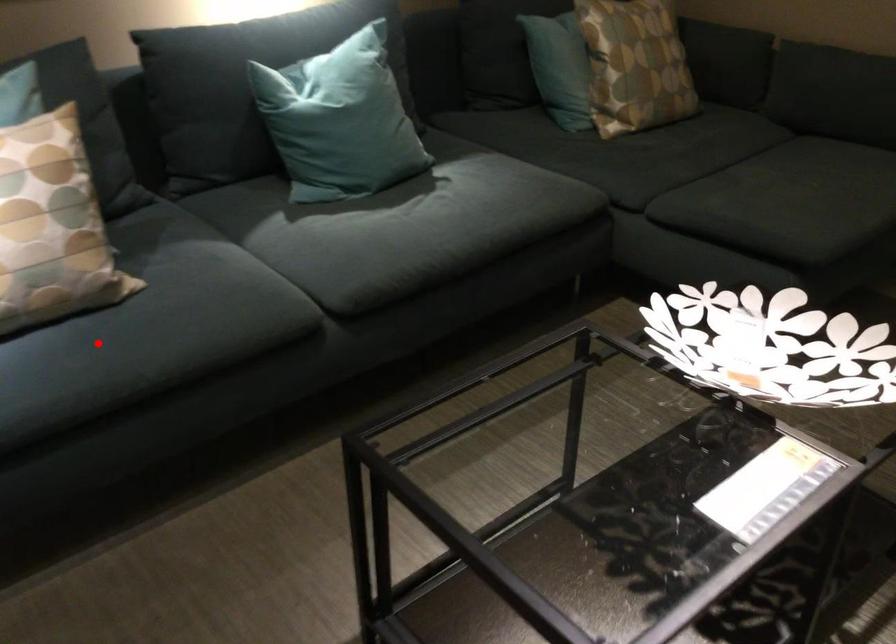
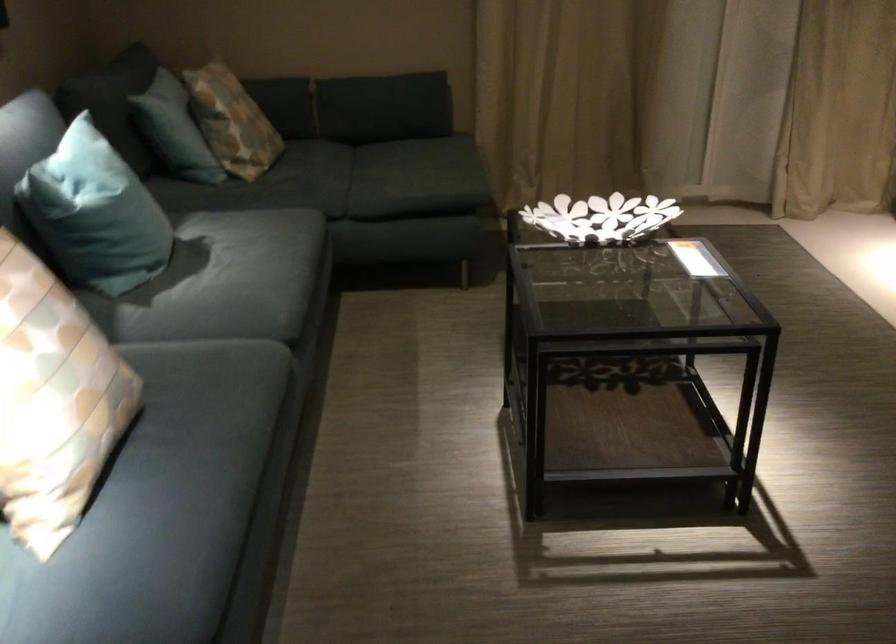
The point at the highlighted location is marked in the first image. Where is the corresponding point in the second image?

(197, 436)